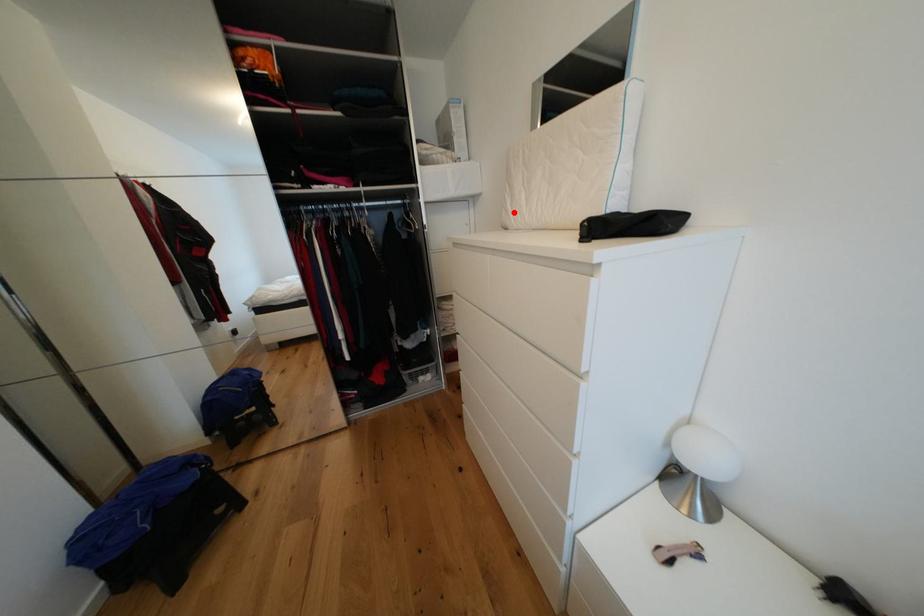
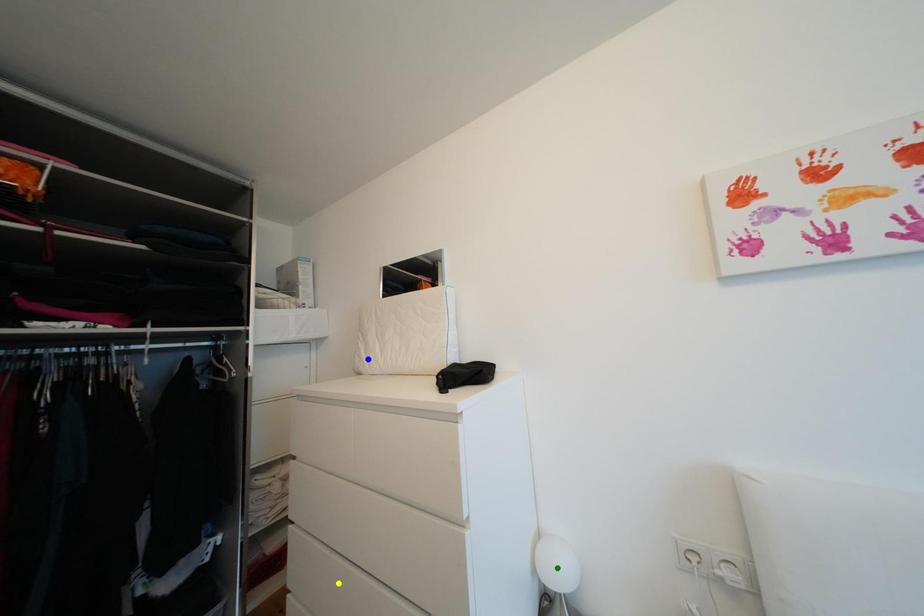
Question: I am providing you with two images of the same scene from different viewpoints. A red point is marked on the first image. You are given multiple points on the second image. Which point in image 2 is actually the same real-world point as the red point in image 1?

Choices:
 (A) yellow point
 (B) blue point
 (C) green point

Answer: (B)